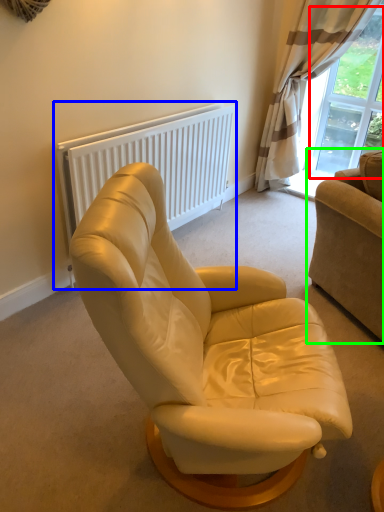
Question: Which object is the closest to the window screen (highlighted by a red box)? Choose among these: radiator (highlighted by a blue box) or studio couch (highlighted by a green box).

Choices:
 (A) radiator
 (B) studio couch

Answer: (A)